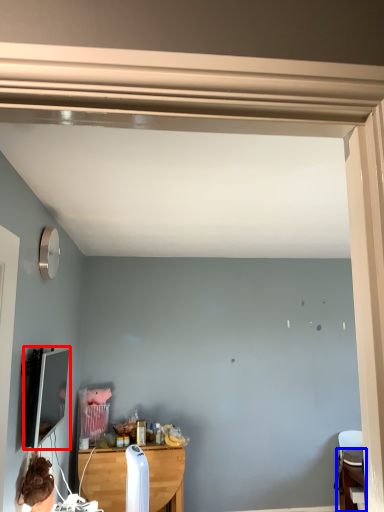
Question: Which object is closer to the camera taking this photo, computer monitor (highlighted by a red box) or table (highlighted by a blue box)?

Choices:
 (A) computer monitor
 (B) table

Answer: (A)